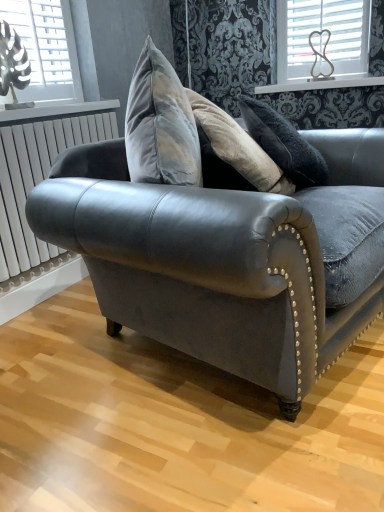
Question: Would you say metallic silver window at upper left, which is the first window in left-to-right order, is outside white plastic heart at upper right, which appears as the first window when viewed from the back?

Choices:
 (A) no
 (B) yes

Answer: (B)

Question: From the image's perspective, is metallic silver window at upper left, which is the 2th window from back to front, located beneath white plastic heart at upper right, which appears as the first window when viewed from the right?

Choices:
 (A) yes
 (B) no

Answer: (A)

Question: Would you say metallic silver window at upper left, which is the first window in left-to-right order, is a long distance from white plastic heart at upper right, which appears as the first window when viewed from the back?

Choices:
 (A) yes
 (B) no

Answer: (A)

Question: From a real-world perspective, is metallic silver window at upper left, which is counted as the second window, starting from the right, beneath white plastic heart at upper right, which is the second window in front-to-back order?

Choices:
 (A) yes
 (B) no

Answer: (B)

Question: Is metallic silver window at upper left, which is counted as the second window, starting from the right, smaller than white plastic heart at upper right, which is counted as the second window, starting from the left?

Choices:
 (A) yes
 (B) no

Answer: (B)

Question: Looking at the image, does white metallic radiator at left seem bigger or smaller compared to metallic silver window at upper left, which is the 2th window from back to front?

Choices:
 (A) big
 (B) small

Answer: (A)

Question: Is white metallic radiator at left in front of or behind metallic silver window at upper left, which is counted as the second window, starting from the right, in the image?

Choices:
 (A) front
 (B) behind

Answer: (A)

Question: Considering the positions of white metallic radiator at left and metallic silver window at upper left, which is the 2th window from back to front, in the image, is white metallic radiator at left taller or shorter than metallic silver window at upper left, which is the 2th window from back to front,?

Choices:
 (A) short
 (B) tall

Answer: (B)

Question: From a real-world perspective, is white metallic radiator at left above or below metallic silver window at upper left, which is the 2th window from back to front?

Choices:
 (A) above
 (B) below

Answer: (B)

Question: In terms of size, does metallic silver window at upper left, which is the 2th window from back to front, appear bigger or smaller than white glossy window sill at upper center?

Choices:
 (A) small
 (B) big

Answer: (B)

Question: In terms of height, does metallic silver window at upper left, which is counted as the second window, starting from the right, look taller or shorter compared to white glossy window sill at upper center?

Choices:
 (A) short
 (B) tall

Answer: (B)

Question: Is point (56, 46) closer or farther from the camera than point (316, 82)?

Choices:
 (A) farther
 (B) closer

Answer: (B)

Question: Choose the correct answer: Is metallic silver window at upper left, which is the first window in left-to-right order, inside white glossy window sill at upper center or outside it?

Choices:
 (A) inside
 (B) outside

Answer: (B)

Question: In the image, is white metallic radiator at left on the left side or the right side of velvet dark gray couch at center?

Choices:
 (A) right
 (B) left

Answer: (B)

Question: In terms of size, does white metallic radiator at left appear bigger or smaller than velvet dark gray couch at center?

Choices:
 (A) small
 (B) big

Answer: (A)